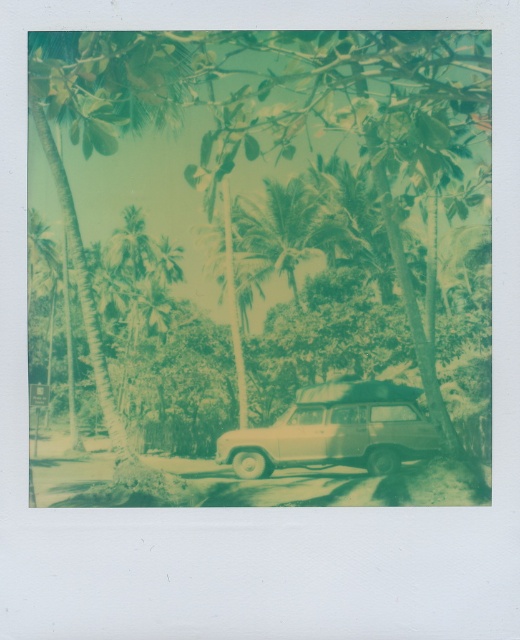
Question: Which of the following is the farthest from the observer?

Choices:
 (A) beige matte suv at center
 (B) green leafy tree at center

Answer: (A)

Question: Among these points, which one is farthest from the camera?

Choices:
 (A) (281, 241)
 (B) (318, 464)
 (C) (329, 148)

Answer: (A)

Question: Does beige matte suv at center appear on the left side of green leafy palm tree at center?

Choices:
 (A) no
 (B) yes

Answer: (A)

Question: Which of these objects is positioned closest to the beige matte suv at center?

Choices:
 (A) green leafy palm tree at center
 (B) green leafy tree at center

Answer: (B)

Question: Can you confirm if beige matte suv at center is bigger than green leafy palm tree at center?

Choices:
 (A) no
 (B) yes

Answer: (B)

Question: Can you confirm if green leafy tree at center is smaller than beige matte suv at center?

Choices:
 (A) yes
 (B) no

Answer: (B)